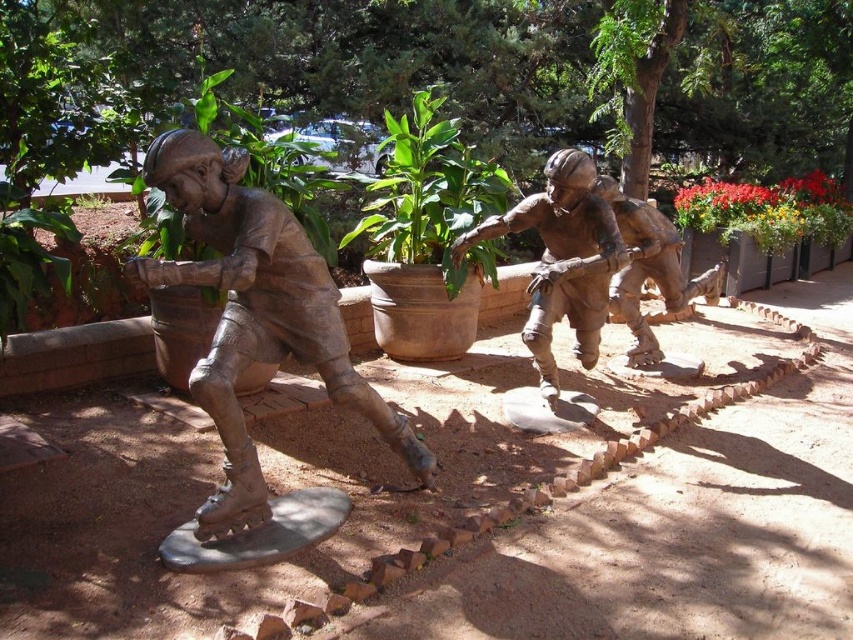
Question: Among these points, which one is farthest from the camera?

Choices:
 (A) (804, 200)
 (B) (405, 147)
 (C) (635, 550)

Answer: (A)

Question: Is brushed metal skateboard at center thinner than bronze statue at center?

Choices:
 (A) no
 (B) yes

Answer: (A)

Question: Which point is farther to the camera?

Choices:
 (A) red flower pot at upper right
 (B) bronze statue at left
 (C) bronze statue at center
 (D) green leafy plant at center

Answer: (A)

Question: Does green leafy plant at center lie in front of bronze statue at center?

Choices:
 (A) yes
 (B) no

Answer: (B)

Question: Among these objects, which one is farthest from the camera?

Choices:
 (A) green leafy plant at center
 (B) brushed metal skateboard at center

Answer: (A)

Question: Can you confirm if bronze statue at center is positioned above red flower pot at upper right?

Choices:
 (A) no
 (B) yes

Answer: (A)